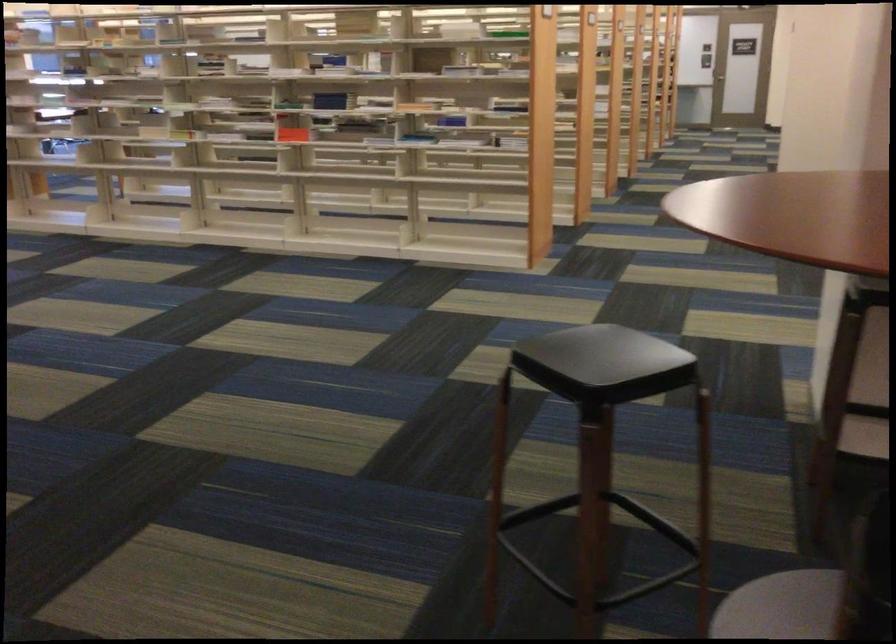
Where would you sit the black chair sitting surface? Please return your answer as a coordinate pair (x, y).

(600, 353)